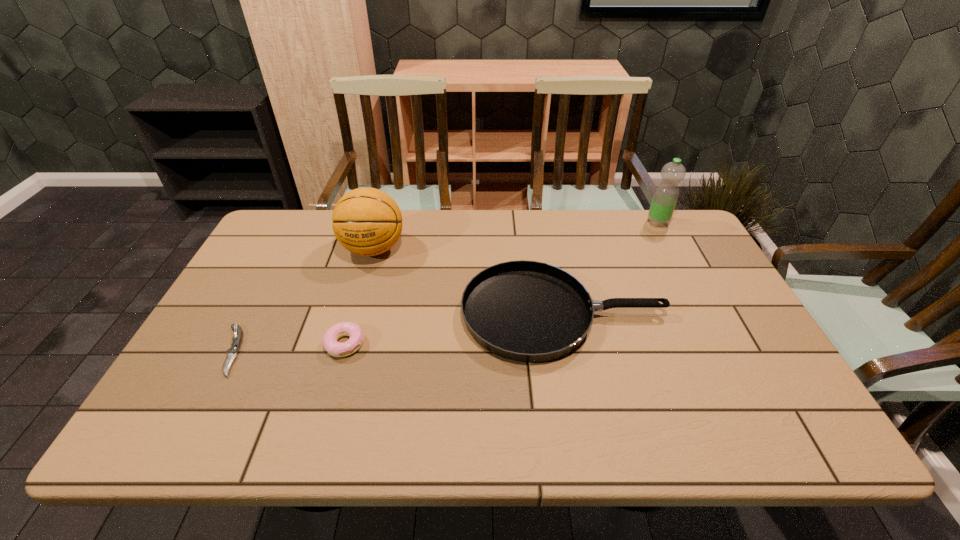
This screenshot has height=540, width=960. Identify the location of water bottle. (665, 197).

Find the location of a particular element. This screenshot has width=960, height=540. the rightmost object is located at coordinates (665, 197).

Where is `the fourth nearest object`? The height and width of the screenshot is (540, 960). the fourth nearest object is located at coordinates (366, 221).

I want to click on the second object from right to left, so click(527, 311).

The height and width of the screenshot is (540, 960). Identify the location of frying pan. (527, 311).

This screenshot has height=540, width=960. Find the location of `doughnut`. doughnut is located at coordinates (330, 337).

Where is `pocketknife`? pocketknife is located at coordinates (237, 339).

This screenshot has width=960, height=540. What are the coordinates of `the leftmost object` in the screenshot? It's located at (237, 339).

Identify the location of vacant space situated 0.070m on the front of the rightmost object. Image resolution: width=960 pixels, height=540 pixels. (667, 242).

Find the location of a particular element. This screenshot has height=540, width=960. blank space located on the surface of the second farthest object near the brand logo is located at coordinates (344, 353).